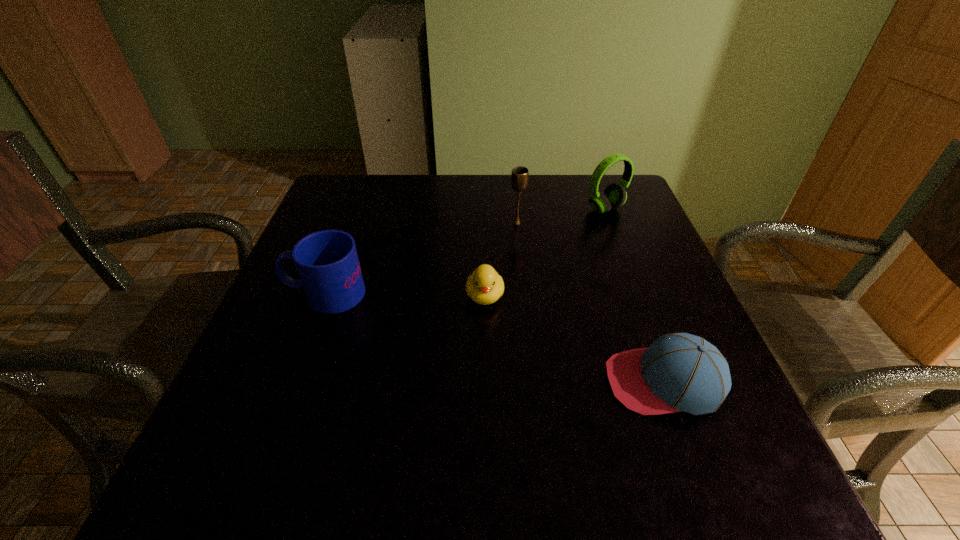
At what (x,y) coordinates should I click in order to perform the action: click on free space at the near edge of the desktop. Please return your answer as a coordinate pair (x, y). Looking at the image, I should click on 458,453.

Where is `free space at the left edge`? free space at the left edge is located at coordinates (314, 310).

I want to click on vacant space at the right edge of the desktop, so click(x=591, y=226).

This screenshot has width=960, height=540. I want to click on vacant space at the far left corner of the desktop, so click(332, 207).

In the image, there is a desktop. Where is `vacant space at the near left corner`? vacant space at the near left corner is located at coordinates (270, 483).

Where is `vacant area at the near right corner of the desktop`? The height and width of the screenshot is (540, 960). vacant area at the near right corner of the desktop is located at coordinates 696,447.

The image size is (960, 540). What are the coordinates of `free space between the third tallest object and the second farthest object` in the screenshot? It's located at (421, 259).

Find the location of a particular element. This screenshot has width=960, height=540. blank region between the nearest object and the second object from left to right is located at coordinates (574, 339).

The height and width of the screenshot is (540, 960). Identify the location of free spot between the duckling and the third shortest object. (405, 295).

The width and height of the screenshot is (960, 540). I want to click on vacant region between the baseball cap and the mug, so [x=494, y=338].